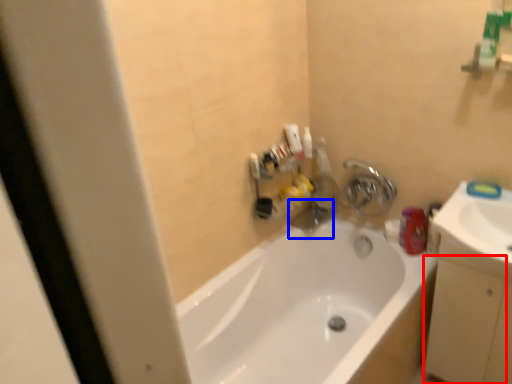
Question: Which object is further to the camera taking this photo, drawer (highlighted by a red box) or plumbing fixture (highlighted by a blue box)?

Choices:
 (A) drawer
 (B) plumbing fixture

Answer: (B)